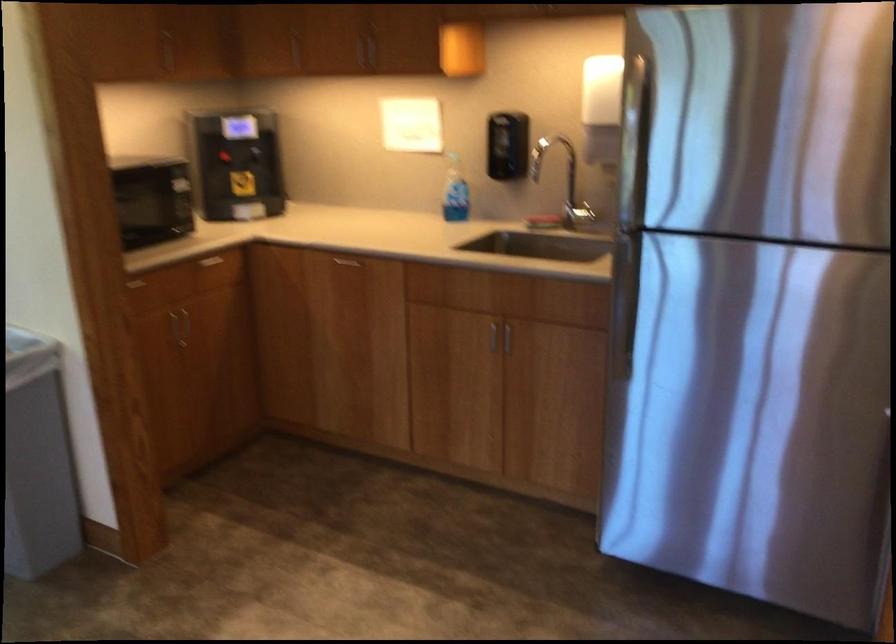
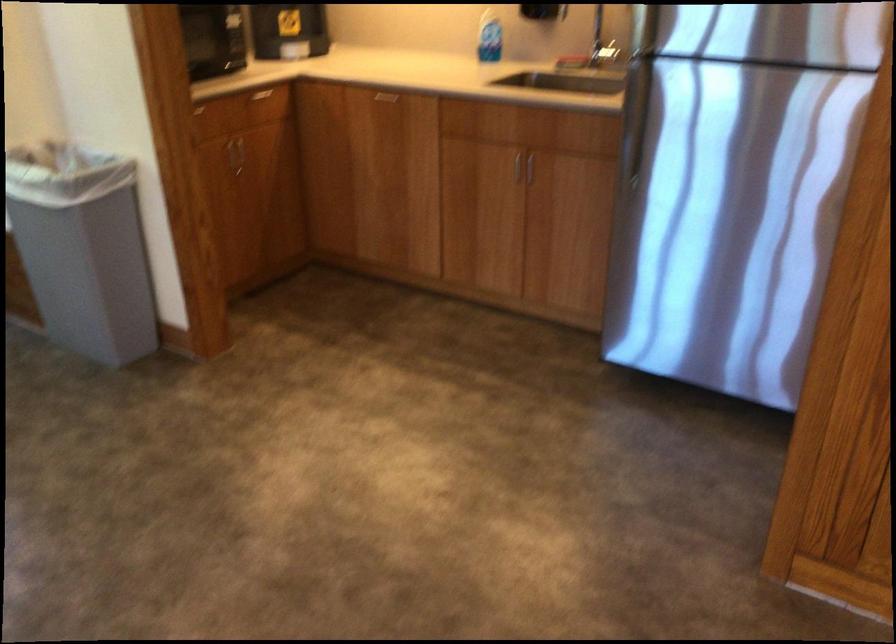
Find the pixel in the second image that matches [502,336] in the first image.

(524, 166)